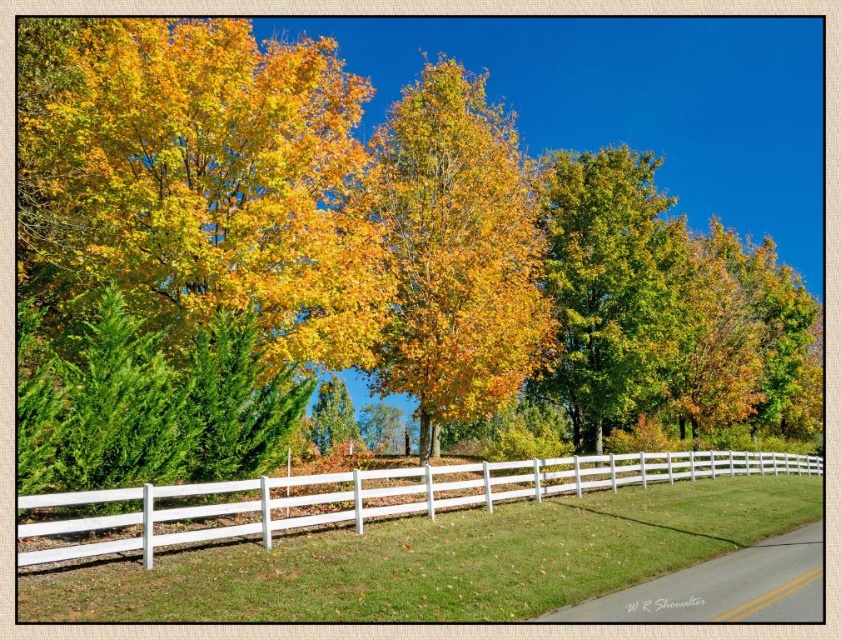
Question: Which point appears farthest from the camera in this image?

Choices:
 (A) (490, 116)
 (B) (561, 257)
 (C) (22, 552)

Answer: (B)

Question: Is green matte tree at center to the left of white painted wood fence at lower center from the viewer's perspective?

Choices:
 (A) no
 (B) yes

Answer: (A)

Question: Which object is closer to the camera taking this photo?

Choices:
 (A) white painted wood fence at lower center
 (B) green matte tree at center

Answer: (A)

Question: Based on their relative distances, which object is farther from the golden yellow leaves at center?

Choices:
 (A) green matte tree at center
 (B) white painted wood fence at lower center

Answer: (B)

Question: Does green matte tree at center have a smaller size compared to white painted wood fence at lower center?

Choices:
 (A) no
 (B) yes

Answer: (A)

Question: Is golden yellow leaves at center further to the viewer compared to white painted wood fence at lower center?

Choices:
 (A) yes
 (B) no

Answer: (A)